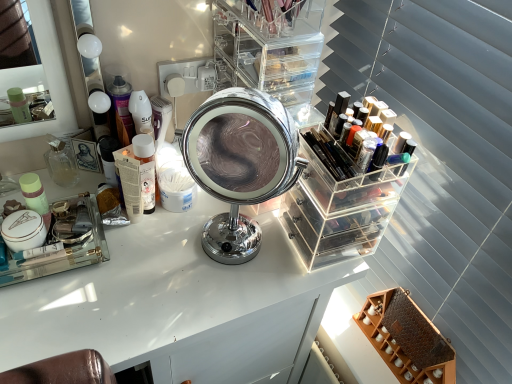
Question: Considering their positions, is clear acrylic organizer at center, which is the second shelf in bottom-to-top order, located in front of or behind chrome/metallic mirror at center?

Choices:
 (A) behind
 (B) front

Answer: (A)

Question: In terms of width, does clear acrylic organizer at center, positioned as the 1th shelf in left-to-right order, look wider or thinner when compared to chrome/metallic mirror at center?

Choices:
 (A) wide
 (B) thin

Answer: (A)

Question: Estimate the real-world distances between objects in this image. Which object is closer to the clear glass mirror at upper left?

Choices:
 (A) wooden honeycomb-patterned shelf at lower right, positioned as the 1th shelf in bottom-to-top order
 (B) shiny black lipstick at upper right, the 1th toiletry viewed from the front
 (C) translucent plastic bottle at left, which is the 2th toiletry from right to left
 (D) chrome/metallic mirror at center
 (E) translucent glass perfume bottle at left, acting as the first toiletry starting from the back

Answer: (E)

Question: Which object is the closest to the shiny black lipstick at upper right, which is counted as the third toiletry, starting from the left?

Choices:
 (A) white glossy table at center
 (B) chrome/metallic mirror at center
 (C) translucent plastic bottle at left, the 2th toiletry in the left-to-right sequence
 (D) translucent glass perfume bottle at left, positioned as the 3th toiletry in right-to-left order
 (E) clear acrylic organizer at center, which appears as the first shelf when viewed from the top

Answer: (E)